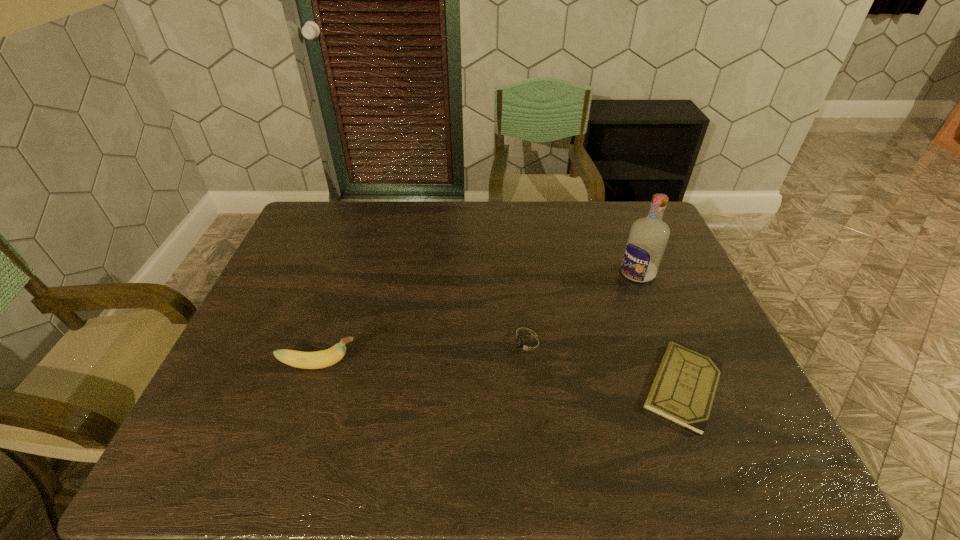
This screenshot has width=960, height=540. In order to click on free space at the far edge in this screenshot , I will do `click(584, 231)`.

Find the location of a particular element. vacant space at the near edge is located at coordinates (418, 416).

At what (x,y) coordinates should I click in order to perform the action: click on vacant region at the left edge. Please return your answer as a coordinate pair (x, y). Image resolution: width=960 pixels, height=540 pixels. Looking at the image, I should click on (237, 358).

Identify the location of vacant space at the right edge of the desktop. (672, 260).

This screenshot has width=960, height=540. In the image, there is a desktop. Identify the location of free space at the far left corner. (348, 210).

Where is `free space at the far right corner`? free space at the far right corner is located at coordinates (635, 218).

Where is `empty location between the third tallest object and the shortest object`? Image resolution: width=960 pixels, height=540 pixels. empty location between the third tallest object and the shortest object is located at coordinates (606, 366).

This screenshot has width=960, height=540. What are the coordinates of `unoccupied area between the shortest object and the leftmost object` in the screenshot? It's located at (501, 376).

The image size is (960, 540). Identify the location of free space between the second shortest object and the tallest object. (583, 308).

This screenshot has width=960, height=540. In order to click on free space between the vodka and the third tallest object in this screenshot , I will do `click(583, 308)`.